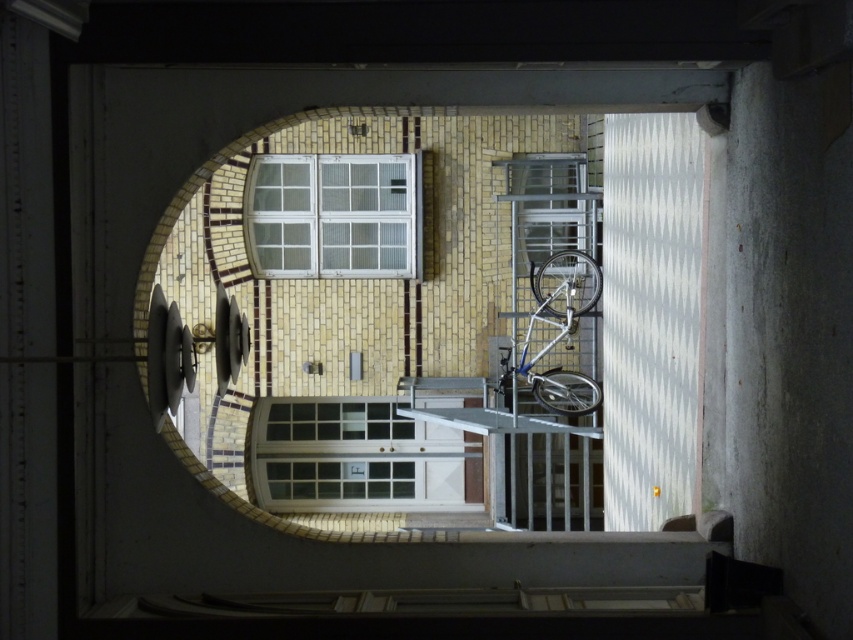
You are a delivery person with a large package that is 1.2 meters wide. You need to enter the courtyard through the entrance shown in the image. Can you fit through the white glass door at center without damaging the door or the package? Please consider the width of the silver metallic bicycle at center that is parked nearby.

The white glass door at center might be wider than the silver metallic bicycle at center. Since the package is 1.2 meters wide, if the door is indeed wider than the bicycle, and assuming the bicycle is narrower than 1.2 meters, there might be enough space. However, without exact measurements, it is uncertain. The answer depends on the actual width comparison between the door and the bicycle.

You are standing in the courtyard and want to hang a picture frame that is 1.2 meters tall on the wall. The frame must be placed above the silver metallic bicycle at center but below the white glass window at upper center. Is this possible given their heights?

The white glass window at upper center has a lesser height compared to the silver metallic bicycle at center. Therefore, there is insufficient vertical space between the bicycle and the window to hang a 1.2 meter tall picture frame.